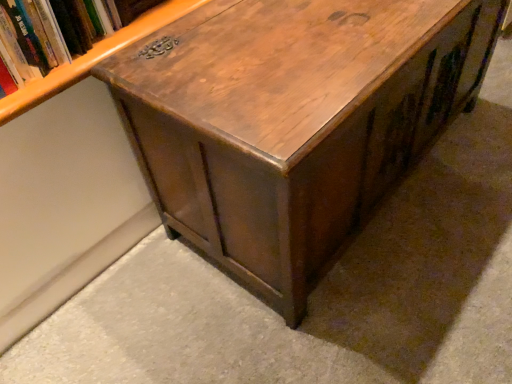
Question: Is wooden bookshelf at upper left thinner than shiny brown wood table at center?

Choices:
 (A) yes
 (B) no

Answer: (A)

Question: Is shiny brown wood table at center surrounded by wooden bookshelf at upper left?

Choices:
 (A) no
 (B) yes

Answer: (A)

Question: Does wooden bookshelf at upper left have a smaller size compared to shiny brown wood table at center?

Choices:
 (A) no
 (B) yes

Answer: (B)

Question: From the image's perspective, does wooden bookshelf at upper left appear lower than shiny brown wood table at center?

Choices:
 (A) yes
 (B) no

Answer: (B)

Question: Are wooden bookshelf at upper left and shiny brown wood table at center beside each other?

Choices:
 (A) no
 (B) yes

Answer: (A)

Question: Considering the relative sizes of wooden bookshelf at upper left and shiny brown wood table at center in the image provided, is wooden bookshelf at upper left shorter than shiny brown wood table at center?

Choices:
 (A) no
 (B) yes

Answer: (B)

Question: Can you confirm if shiny brown wood table at center is bigger than wooden bookshelf at upper left?

Choices:
 (A) yes
 (B) no

Answer: (A)

Question: Is shiny brown wood table at center not close to wooden bookshelf at upper left?

Choices:
 (A) no
 (B) yes

Answer: (A)

Question: Is shiny brown wood table at center behind wooden bookshelf at upper left?

Choices:
 (A) yes
 (B) no

Answer: (B)

Question: Is shiny brown wood table at center aimed at wooden bookshelf at upper left?

Choices:
 (A) no
 (B) yes

Answer: (A)

Question: Is shiny brown wood table at center surrounding wooden bookshelf at upper left?

Choices:
 (A) no
 (B) yes

Answer: (A)

Question: Does shiny brown wood table at center lie in front of wooden bookshelf at upper left?

Choices:
 (A) no
 (B) yes

Answer: (B)

Question: Is wooden bookshelf at upper left taller or shorter than shiny brown wood table at center?

Choices:
 (A) tall
 (B) short

Answer: (B)